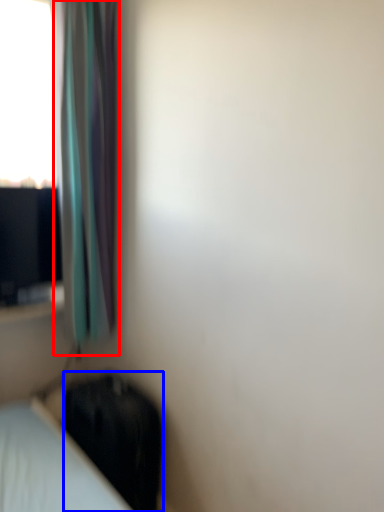
Question: Which of the following is the farthest to the observer, curtain (highlighted by a red box) or luggage (highlighted by a blue box)?

Choices:
 (A) curtain
 (B) luggage

Answer: (B)